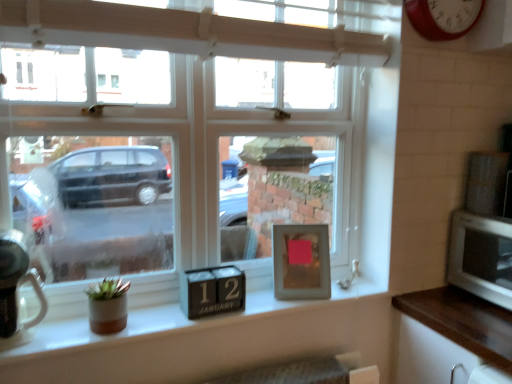
Question: Is red metallic clock at upper right to the left of silver metallic microwave at right from the viewer's perspective?

Choices:
 (A) no
 (B) yes

Answer: (B)

Question: Is red metallic clock at upper right looking in the opposite direction of silver metallic microwave at right?

Choices:
 (A) yes
 (B) no

Answer: (B)

Question: Is red metallic clock at upper right bigger than silver metallic microwave at right?

Choices:
 (A) no
 (B) yes

Answer: (A)

Question: Does red metallic clock at upper right appear on the right side of silver metallic microwave at right?

Choices:
 (A) no
 (B) yes

Answer: (A)

Question: Is red metallic clock at upper right aimed at silver metallic microwave at right?

Choices:
 (A) no
 (B) yes

Answer: (A)

Question: Is silver metallic microwave at right to the left or to the right of brown wood counter top at lower right in the image?

Choices:
 (A) left
 (B) right

Answer: (B)

Question: In terms of width, does silver metallic microwave at right look wider or thinner when compared to brown wood counter top at lower right?

Choices:
 (A) wide
 (B) thin

Answer: (B)

Question: From a real-world perspective, is silver metallic microwave at right physically located above or below brown wood counter top at lower right?

Choices:
 (A) below
 (B) above

Answer: (B)

Question: Is silver metallic microwave at right in front of or behind brown wood counter top at lower right in the image?

Choices:
 (A) front
 (B) behind

Answer: (B)

Question: From a real-world perspective, is red metallic clock at upper right positioned above or below brushed metal kettle at left, arranged as the first appliance when ordered from the bottom?

Choices:
 (A) above
 (B) below

Answer: (A)

Question: Is red metallic clock at upper right in front of or behind brushed metal kettle at left, which ranks as the 2th appliance in top-to-bottom order, in the image?

Choices:
 (A) front
 (B) behind

Answer: (B)

Question: Is red metallic clock at upper right taller or shorter than brushed metal kettle at left, acting as the 2th appliance starting from the right?

Choices:
 (A) tall
 (B) short

Answer: (A)

Question: Is red metallic clock at upper right spatially inside brushed metal kettle at left, which ranks as the 2th appliance in top-to-bottom order, or outside of it?

Choices:
 (A) outside
 (B) inside

Answer: (A)

Question: Is clear glass window at center bigger or smaller than brown wood counter top at lower right?

Choices:
 (A) big
 (B) small

Answer: (A)

Question: Which is correct: clear glass window at center is inside brown wood counter top at lower right, or outside of it?

Choices:
 (A) inside
 (B) outside

Answer: (B)